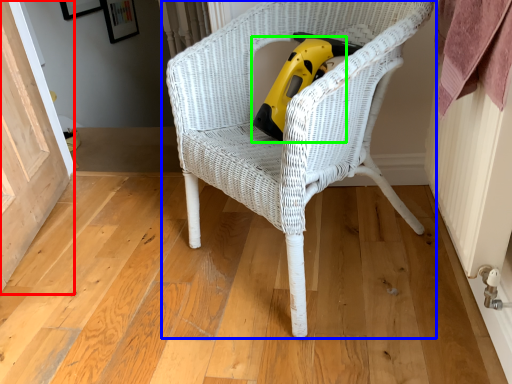
Question: Which object is the farthest from screen door (highlighted by a red box)? Choose among these: chair (highlighted by a blue box) or vacuum (highlighted by a green box).

Choices:
 (A) chair
 (B) vacuum

Answer: (B)